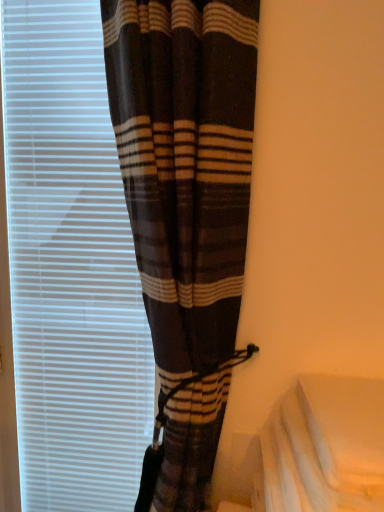
Question: From a real-world perspective, is white fabric at lower right physically located above or below brown plaid curtain at left?

Choices:
 (A) above
 (B) below

Answer: (B)

Question: In terms of size, does white fabric at lower right appear bigger or smaller than brown plaid curtain at left?

Choices:
 (A) small
 (B) big

Answer: (A)

Question: Based on their relative distances, which object is farther from the brown plaid curtain at left?

Choices:
 (A) white matte window blind at left
 (B) white fabric at lower right

Answer: (B)

Question: Which object is positioned farthest from the white matte window blind at left?

Choices:
 (A) brown plaid curtain at left
 (B) white fabric at lower right

Answer: (B)